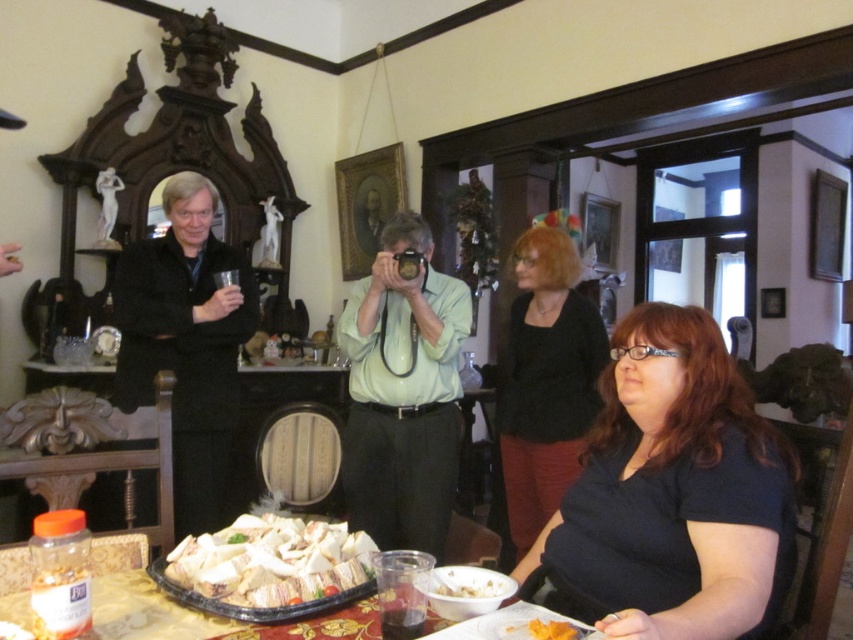
Is black matte shirt at lower right positioned before black matte suit at left?

Yes, black matte shirt at lower right is in front of black matte suit at left.

Where is `black matte shirt at lower right`? This screenshot has height=640, width=853. black matte shirt at lower right is located at coordinates (675, 492).

Is point (657, 419) less distant than point (209, 273)?

Yes, it is in front of point (209, 273).

You are a GUI agent. You are given a task and a screenshot of the screen. Output one action in this format:
    pyautogui.click(x=<x>, y=<y>)
    Task: Click on the black matte shirt at lower right
    Image resolution: width=853 pixels, height=640 pixels.
    Given the screenshot: What is the action you would take?
    pyautogui.click(x=675, y=492)

Is point (450, 285) positioned after point (529, 465)?

No, (450, 285) is closer to viewer.

Can you confirm if green matte shirt at center is positioned above black matte blouse at center?

Yes.

Where is `green matte shirt at center`? Image resolution: width=853 pixels, height=640 pixels. green matte shirt at center is located at coordinates (403, 394).

In order to click on green matte shirt at center in this screenshot , I will do `click(403, 394)`.

Does point (532, 305) come in front of point (10, 608)?

No, (532, 305) is further to viewer.

Consider the image. Can you confirm if black matte blouse at center is positioned to the right of translucent plastic tray at lower center?

Yes, black matte blouse at center is to the right of translucent plastic tray at lower center.

Is point (527, 513) farther from camera compared to point (160, 608)?

Yes, it is.

Identify the location of black matte blouse at center. (544, 380).